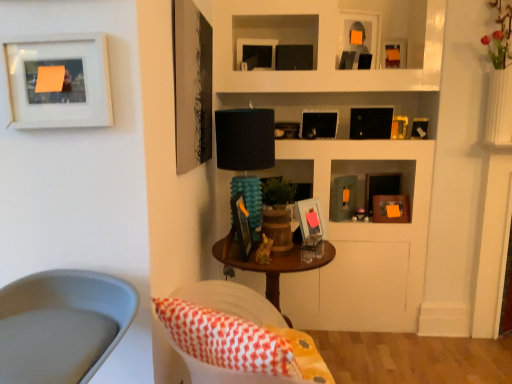
In order to click on free point below matte black picture frame at upper center, which is counted as the 4th picture frame, starting from the front (from a real-world perspective) in this screenshot , I will do `click(318, 140)`.